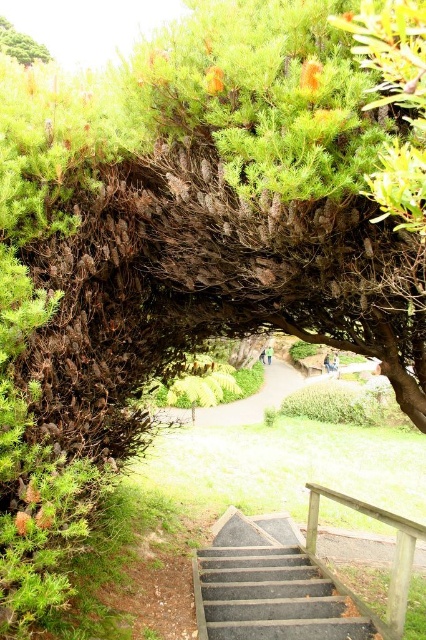
You are a hiker carrying a backpack and need to decide whether to take the dark gray concrete stairs at center or the path under the green leafy tree at upper left. Which option is shorter in height?

The dark gray concrete stairs at center is not as tall as the green leafy tree at upper left, so the stairs are shorter in height.